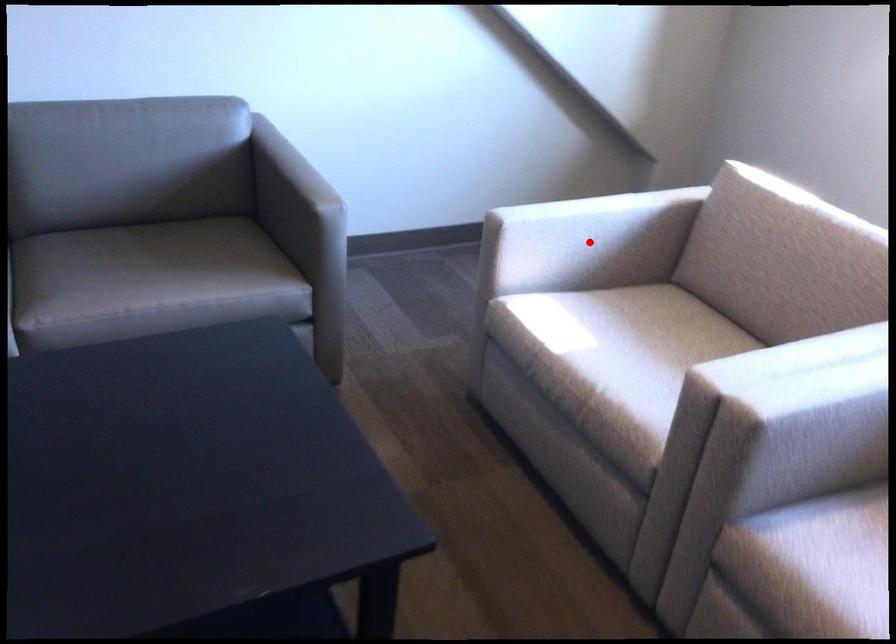
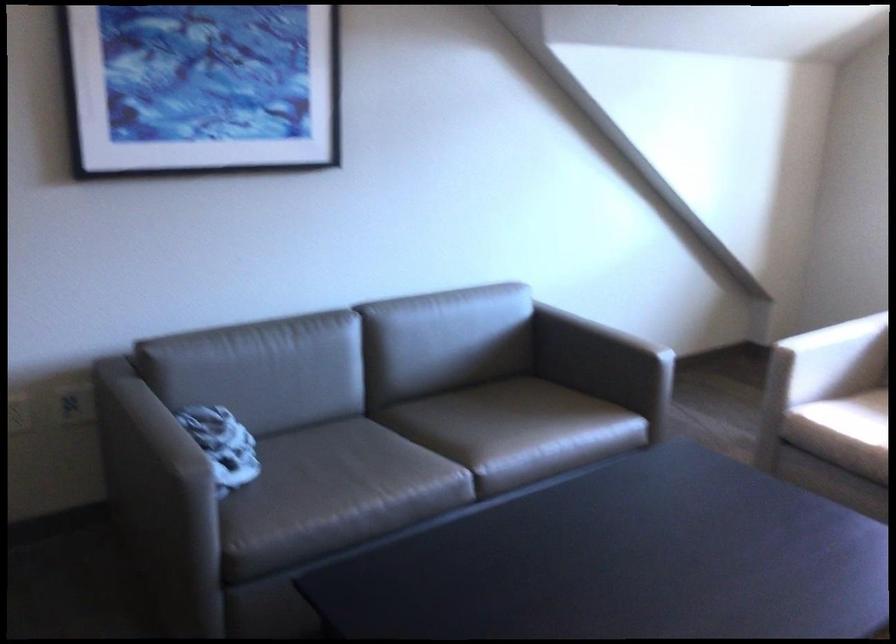
Question: I am providing you with two images of the same scene from different viewpoints. A red point is shown in image1. For the corresponding object point in image2, is it positioned nearer or farther from the camera?

Choices:
 (A) Nearer
 (B) Farther

Answer: (B)